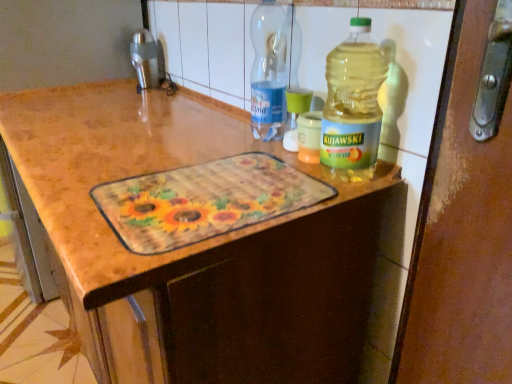
Question: Does transparent plastic bottle at center, arranged as the 1th bottle when viewed from the left, have a lesser height compared to metallic brushed faucet at upper left?

Choices:
 (A) no
 (B) yes

Answer: (A)

Question: Is transparent plastic bottle at center, which ranks as the 2th bottle in right-to-left order, next to metallic brushed faucet at upper left?

Choices:
 (A) no
 (B) yes

Answer: (A)

Question: Is the position of transparent plastic bottle at center, which ranks as the 2th bottle in front-to-back order, more distant than that of metallic brushed faucet at upper left?

Choices:
 (A) yes
 (B) no

Answer: (B)

Question: Would you consider transparent plastic bottle at center, which appears as the first bottle when viewed from the back, to be distant from metallic brushed faucet at upper left?

Choices:
 (A) no
 (B) yes

Answer: (A)

Question: Is transparent plastic bottle at center, which ranks as the 2th bottle in right-to-left order, bigger than metallic brushed faucet at upper left?

Choices:
 (A) no
 (B) yes

Answer: (B)

Question: From the image's perspective, is translucent plastic bottle at upper right, placed as the 1th bottle when sorted from right to left, located above or below transparent plastic bottle at center, arranged as the 1th bottle when viewed from the left?

Choices:
 (A) above
 (B) below

Answer: (B)

Question: From their relative heights in the image, would you say translucent plastic bottle at upper right, placed as the 1th bottle when sorted from right to left, is taller or shorter than transparent plastic bottle at center, which appears as the first bottle when viewed from the back?

Choices:
 (A) tall
 (B) short

Answer: (B)

Question: Is translucent plastic bottle at upper right, arranged as the 2th bottle when viewed from the back, situated inside transparent plastic bottle at center, which appears as the first bottle when viewed from the back, or outside?

Choices:
 (A) outside
 (B) inside

Answer: (A)

Question: Looking at their shapes, would you say translucent plastic bottle at upper right, marked as the 1th bottle in a front-to-back arrangement, is wider or thinner than transparent plastic bottle at center, which ranks as the 2th bottle in right-to-left order?

Choices:
 (A) wide
 (B) thin

Answer: (B)

Question: From the image's perspective, is translucent plastic bottle at upper right, marked as the 2th bottle in a left-to-right arrangement, above or below metallic brushed faucet at upper left?

Choices:
 (A) below
 (B) above

Answer: (A)

Question: Is translucent plastic bottle at upper right, arranged as the 2th bottle when viewed from the back, bigger or smaller than metallic brushed faucet at upper left?

Choices:
 (A) big
 (B) small

Answer: (A)

Question: Choose the correct answer: Is translucent plastic bottle at upper right, marked as the 2th bottle in a left-to-right arrangement, inside metallic brushed faucet at upper left or outside it?

Choices:
 (A) inside
 (B) outside

Answer: (B)

Question: Based on their positions, is translucent plastic bottle at upper right, placed as the 1th bottle when sorted from right to left, located to the left or right of metallic brushed faucet at upper left?

Choices:
 (A) right
 (B) left

Answer: (A)

Question: From the image's perspective, relative to translucent plastic bottle at upper right, marked as the 2th bottle in a left-to-right arrangement, is transparent plastic bottle at center, arranged as the 1th bottle when viewed from the left, above or below?

Choices:
 (A) below
 (B) above

Answer: (B)

Question: Is transparent plastic bottle at center, which ranks as the 2th bottle in front-to-back order, in front of or behind translucent plastic bottle at upper right, placed as the 1th bottle when sorted from right to left, in the image?

Choices:
 (A) behind
 (B) front

Answer: (A)